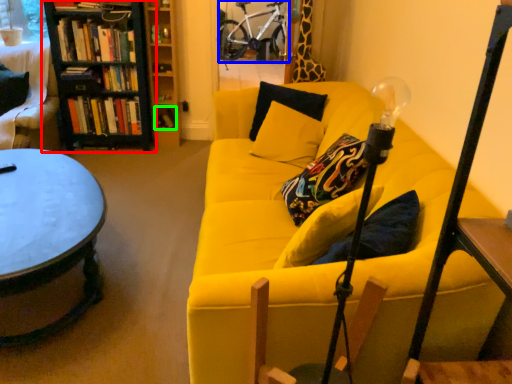
Question: Which is farther away from bookcase (highlighted by a red box)? bicycle (highlighted by a blue box) or book (highlighted by a green box)?

Choices:
 (A) bicycle
 (B) book

Answer: (A)